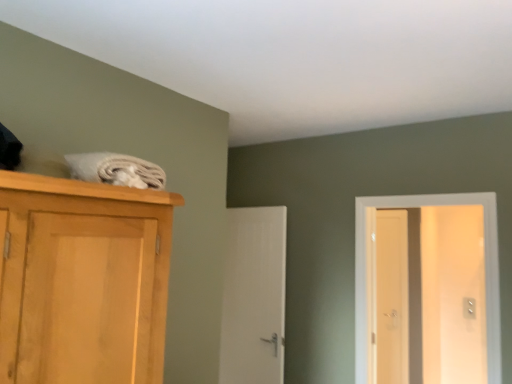
Describe the element at coordinates (485, 271) in the screenshot. I see `white glossy door at right, which ranks as the 1th door in right-to-left order` at that location.

Where is `light brown wooden screen door at right`? light brown wooden screen door at right is located at coordinates (392, 296).

Which is in front, light brown wooden screen door at right or white glossy door at right, which ranks as the 2th door in left-to-right order?

white glossy door at right, which ranks as the 2th door in left-to-right order, is closer to the camera.

Considering the positions of objects light brown wooden screen door at right and white glossy door at right, which ranks as the 1th door in right-to-left order, in the image provided, who is more to the left, light brown wooden screen door at right or white glossy door at right, which ranks as the 1th door in right-to-left order,?

white glossy door at right, which ranks as the 1th door in right-to-left order, is more to the left.

Measure the distance from light brown wooden screen door at right to white glossy door at right, the first door from the front.

They are 1.53 meters apart.

Would you say light brown wooden screen door at right contains white glossy door at right, which ranks as the 2th door in left-to-right order?

No, white glossy door at right, which ranks as the 2th door in left-to-right order, is not a part of light brown wooden screen door at right.

In terms of width, does white glossy door at right, which ranks as the 1th door in right-to-left order, look wider or thinner when compared to light brown wooden screen door at right?

Considering their sizes, white glossy door at right, which ranks as the 1th door in right-to-left order, looks broader than light brown wooden screen door at right.

From a real-world perspective, does white glossy door at right, the 2th door in the back-to-front sequence, sit lower than light brown wooden screen door at right?

Incorrect, from a real-world perspective, white glossy door at right, the 2th door in the back-to-front sequence, is higher than light brown wooden screen door at right.

Considering the positions of objects white glossy door at right, which ranks as the 2th door in left-to-right order, and light brown wooden screen door at right in the image provided, who is more to the left, white glossy door at right, which ranks as the 2th door in left-to-right order, or light brown wooden screen door at right?

From the viewer's perspective, white glossy door at right, which ranks as the 2th door in left-to-right order, appears more on the left side.

In the image, there is a white glossy door at right, the 2th door in the back-to-front sequence. Identify the location of screen door below it (from the image's perspective). This screenshot has width=512, height=384. (392, 296).

Considering the relative sizes of white smooth door at center, marked as the second door in a right-to-left arrangement, and light brown wooden screen door at right in the image provided, is white smooth door at center, marked as the second door in a right-to-left arrangement, taller than light brown wooden screen door at right?

No.

From the image's perspective, is white smooth door at center, which is counted as the first door, starting from the left, above or below light brown wooden screen door at right?

Clearly, from the image's perspective, white smooth door at center, which is counted as the first door, starting from the left, is above light brown wooden screen door at right.

Between white smooth door at center, which is counted as the first door, starting from the left, and light brown wooden screen door at right, which one has smaller width?

light brown wooden screen door at right.

Which point is more distant from viewer, (392, 244) or (254, 311)?

The point (392, 244) is farther from the camera.

From a real-world perspective, is light brown wooden screen door at right over white smooth door at center, which is counted as the first door, starting from the left?

Actually, light brown wooden screen door at right is physically below white smooth door at center, which is counted as the first door, starting from the left, in the real world.

Considering the sizes of objects light brown wooden screen door at right and white smooth door at center, which is the 1th door in back-to-front order, in the image provided, who is taller, light brown wooden screen door at right or white smooth door at center, which is the 1th door in back-to-front order,?

With more height is light brown wooden screen door at right.

Is light brown wooden screen door at right positioned in front of white smooth door at center, which is the 1th door in back-to-front order?

That is False.

Considering the relative positions of white glossy door at right, the 2th door in the back-to-front sequence, and white smooth door at center, marked as the second door in a right-to-left arrangement, in the image provided, is white glossy door at right, the 2th door in the back-to-front sequence, in front of white smooth door at center, marked as the second door in a right-to-left arrangement,?

Yes, it is.

Is white glossy door at right, the 2th door in the back-to-front sequence, wider than white smooth door at center, marked as the second door in a right-to-left arrangement?

Yes.

Is white glossy door at right, the first door from the front, oriented towards white smooth door at center, which is counted as the first door, starting from the left?

No, white glossy door at right, the first door from the front, is not oriented towards white smooth door at center, which is counted as the first door, starting from the left.

From the image's perspective, which is above, white glossy door at right, the 2th door in the back-to-front sequence, or white smooth door at center, which is counted as the first door, starting from the left?

From the image's view, white glossy door at right, the 2th door in the back-to-front sequence, is above.

Does white smooth door at center, which is the 1th door in back-to-front order, lie in front of white glossy door at right, the first door from the front?

No, white smooth door at center, which is the 1th door in back-to-front order, is further to the viewer.

Could you tell me if white smooth door at center, which is counted as the second door, starting from the front, is turned towards white glossy door at right, which ranks as the 1th door in right-to-left order?

No.

Between white smooth door at center, which is the 1th door in back-to-front order, and white glossy door at right, which ranks as the 2th door in left-to-right order, which one has larger size?

white glossy door at right, which ranks as the 2th door in left-to-right order, is bigger.

Find the location of a particular element. The height and width of the screenshot is (384, 512). the 2nd door above when counting from the light brown wooden screen door at right (from the image's perspective) is located at coordinates (485, 271).

This screenshot has width=512, height=384. In the image, there is a white glossy door at right, the 2th door in the back-to-front sequence. In order to click on screen door below it (from the image's perspective) in this screenshot , I will do `click(392, 296)`.

Estimate the real-world distances between objects in this image. Which object is closer to white smooth door at center, which is the 1th door in back-to-front order, white glossy door at right, the first door from the front, or light brown wooden screen door at right?

Among the two, white glossy door at right, the first door from the front, is located nearer to white smooth door at center, which is the 1th door in back-to-front order.

Based on their spatial positions, is light brown wooden screen door at right or white glossy door at right, the 2th door in the back-to-front sequence, further from white smooth door at center, which is counted as the first door, starting from the left?

light brown wooden screen door at right lies further to white smooth door at center, which is counted as the first door, starting from the left, than the other object.

Considering their positions, is white smooth door at center, which is counted as the second door, starting from the front, positioned closer to light brown wooden screen door at right than white glossy door at right, which ranks as the 1th door in right-to-left order?

white glossy door at right, which ranks as the 1th door in right-to-left order.

Based on their spatial positions, is white glossy door at right, the 2th door in the back-to-front sequence, or white smooth door at center, which is the 1th door in back-to-front order, closer to light brown wooden screen door at right?

white glossy door at right, the 2th door in the back-to-front sequence, is closer to light brown wooden screen door at right.

Which object lies nearer to the anchor point white glossy door at right, the first door from the front, white smooth door at center, marked as the second door in a right-to-left arrangement, or light brown wooden screen door at right?

The object closer to white glossy door at right, the first door from the front, is white smooth door at center, marked as the second door in a right-to-left arrangement.

Based on their spatial positions, is light brown wooden screen door at right or white smooth door at center, which is the 1th door in back-to-front order, further from white glossy door at right, the first door from the front?

light brown wooden screen door at right.

At what (x,y) coordinates should I click in order to perform the action: click on door located between white glossy door at right, which ranks as the 2th door in left-to-right order, and light brown wooden screen door at right in the depth direction. Please return your answer as a coordinate pair (x, y). Looking at the image, I should click on (254, 296).